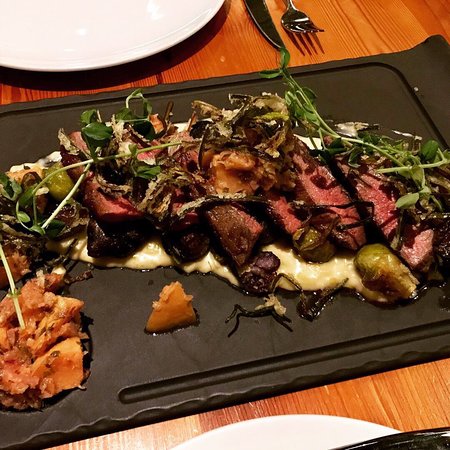
The height and width of the screenshot is (450, 450). What are the coordinates of `fork` in the screenshot? It's located at (302, 21).